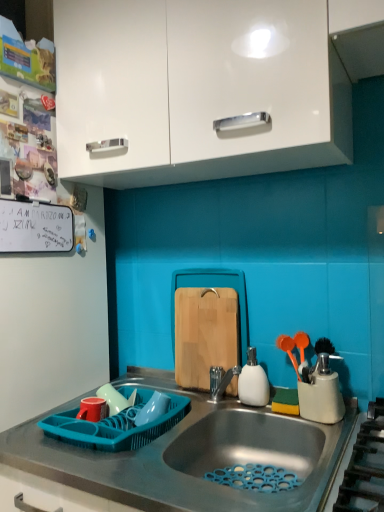
Locate an element on the screen. Image resolution: width=384 pixels, height=512 pixels. vacant space positioned to the left of natural wood cutting board at center is located at coordinates (172, 390).